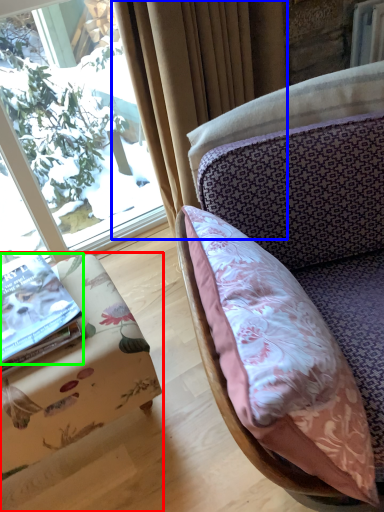
Question: Which object is the farthest from furniture (highlighted by a red box)? Choose among these: curtain (highlighted by a blue box) or book (highlighted by a green box).

Choices:
 (A) curtain
 (B) book

Answer: (A)